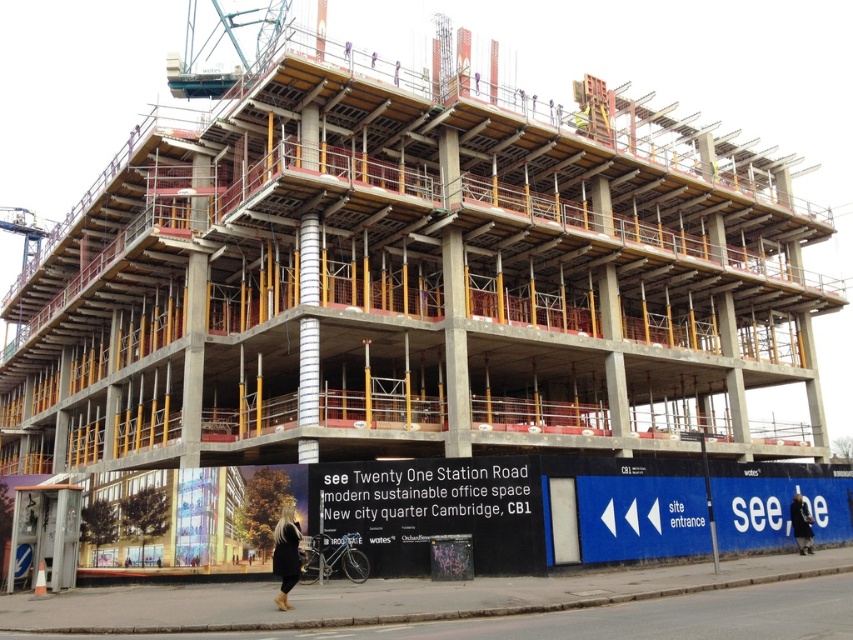
Question: Which point is farther to the camera?

Choices:
 (A) (286, 589)
 (B) (801, 541)

Answer: (B)

Question: Is the position of black leather jacket at lower center less distant than that of dark blue jacket at lower center?

Choices:
 (A) yes
 (B) no

Answer: (A)

Question: Is black leather jacket at lower center below dark blue jacket at lower center?

Choices:
 (A) no
 (B) yes

Answer: (A)

Question: Which point appears farthest from the camera in this image?

Choices:
 (A) (788, 506)
 (B) (280, 566)

Answer: (A)

Question: In this image, where is black leather jacket at lower center located relative to dark blue jacket at lower center?

Choices:
 (A) right
 (B) left

Answer: (B)